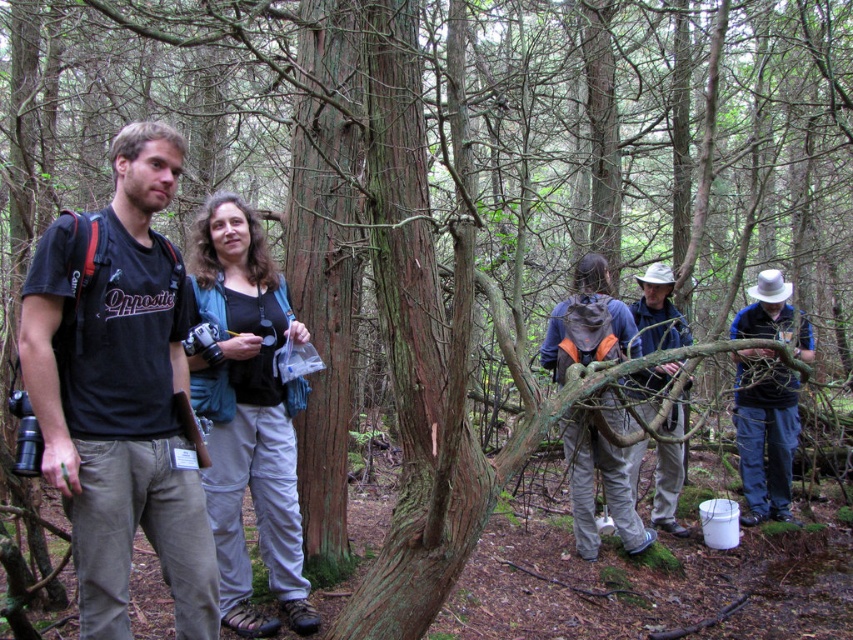
Does point (154, 444) come farther from viewer compared to point (277, 458)?

No.

You are a GUI agent. You are given a task and a screenshot of the screen. Output one action in this format:
    pyautogui.click(x=<x>, y=<y>)
    Task: Click on the matte black t-shirt at left
    The width and height of the screenshot is (853, 640).
    Given the screenshot: What is the action you would take?
    pyautogui.click(x=120, y=394)

Is matte black shirt at center smaller than khaki cotton pants at center?

Indeed, matte black shirt at center has a smaller size compared to khaki cotton pants at center.

Is matte black shirt at center above khaki cotton pants at center?

Yes, matte black shirt at center is above khaki cotton pants at center.

Where is `matte black shirt at center`? matte black shirt at center is located at coordinates (248, 413).

I want to click on matte black shirt at center, so click(x=248, y=413).

Between point (132, 320) and point (675, 316), which one is positioned behind?

Point (675, 316)

Does matte black t-shirt at left have a lesser width compared to khaki cotton pants at center?

Correct, matte black t-shirt at left's width is less than khaki cotton pants at center's.

Is point (91, 333) positioned behind point (672, 365)?

No.

I want to click on matte black t-shirt at left, so click(x=120, y=394).